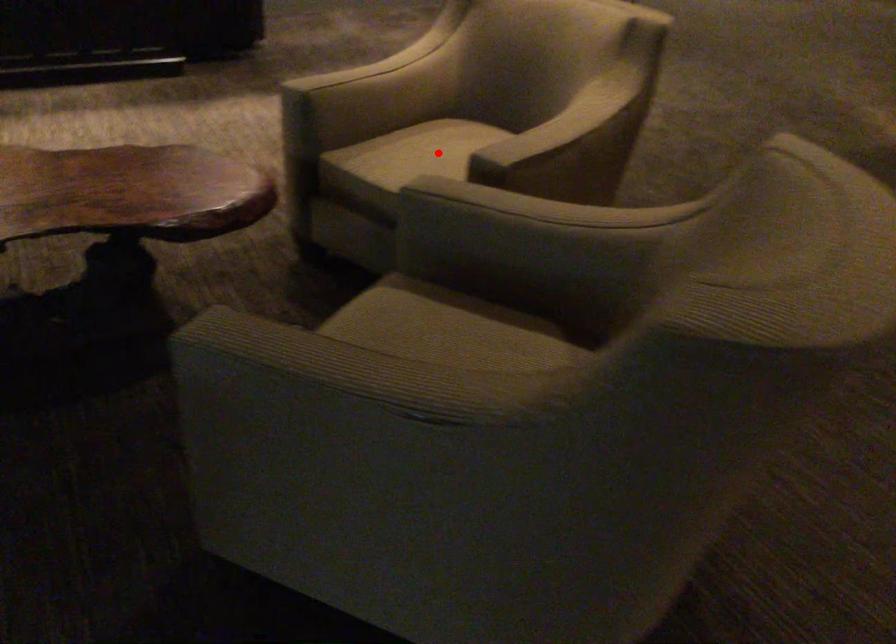
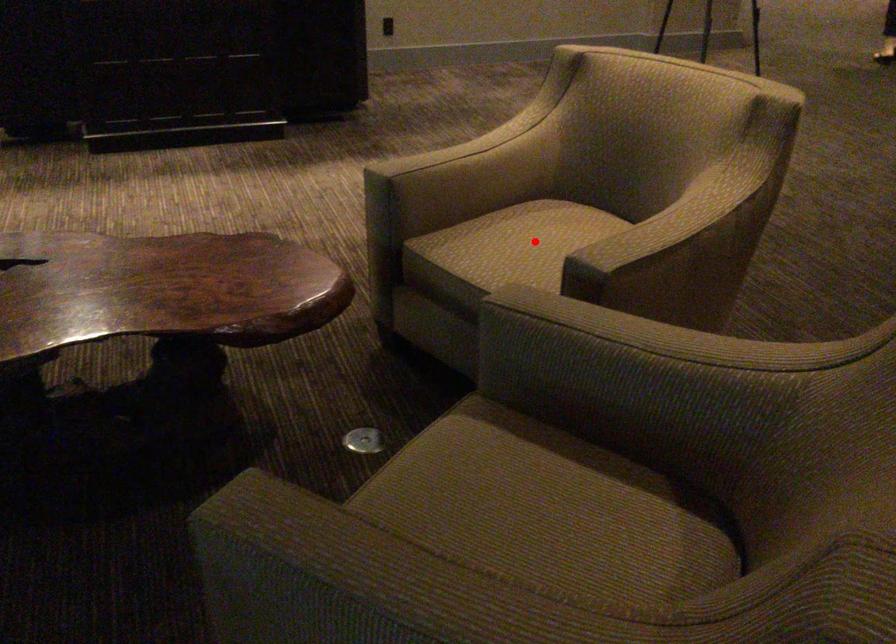
I am providing you with two images of the same scene from different viewpoints. A red point is marked on the first image and another point is marked on the second image. Does the point marked in image1 correspond to the same location as the one in image2?

Yes